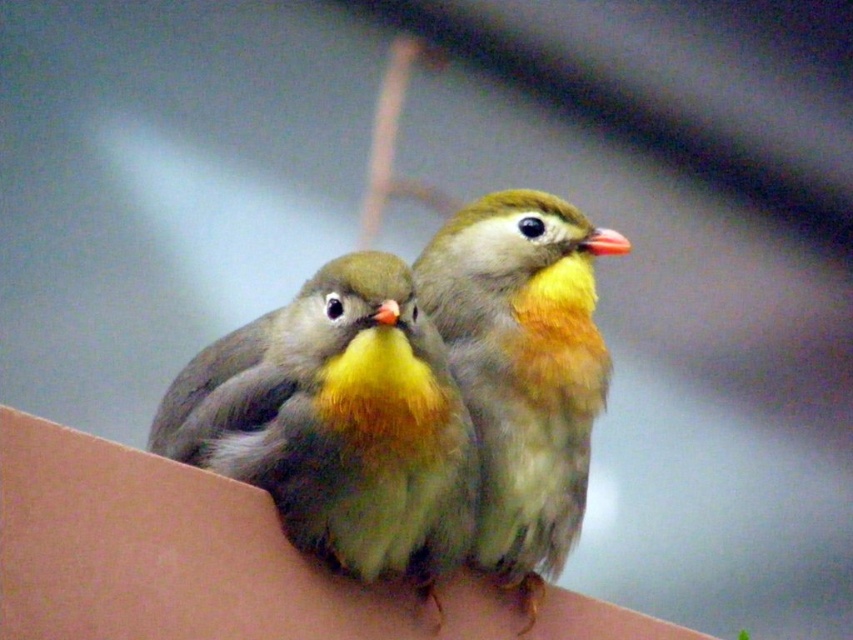
Question: Where is soft yellow feathers at center located in relation to soft yellow-green feathers at center in the image?

Choices:
 (A) above
 (B) below

Answer: (B)

Question: Which object appears farthest from the camera in this image?

Choices:
 (A) soft yellow-green feathers at center
 (B) soft yellow feathers at center

Answer: (A)

Question: Which of the following is the farthest from the observer?

Choices:
 (A) (339, 269)
 (B) (544, 564)

Answer: (B)

Question: Can you confirm if soft yellow feathers at center is bigger than soft yellow-green feathers at center?

Choices:
 (A) yes
 (B) no

Answer: (B)

Question: Does soft yellow feathers at center appear on the right side of soft yellow-green feathers at center?

Choices:
 (A) no
 (B) yes

Answer: (A)